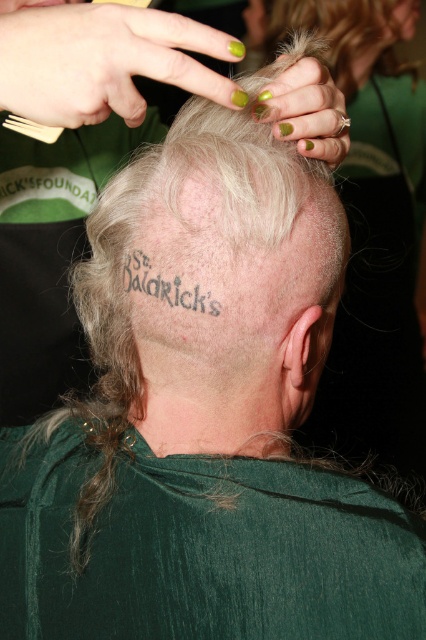
Between gray tattooed skin at center and black tattoo at center back, which one appears on the left side from the viewer's perspective?

gray tattooed skin at center is more to the left.

Between gray tattooed skin at center and black tattoo at center back, which one is positioned lower?

Positioned lower is black tattoo at center back.

The image size is (426, 640). In order to click on gray tattooed skin at center in this screenshot , I will do `click(175, 211)`.